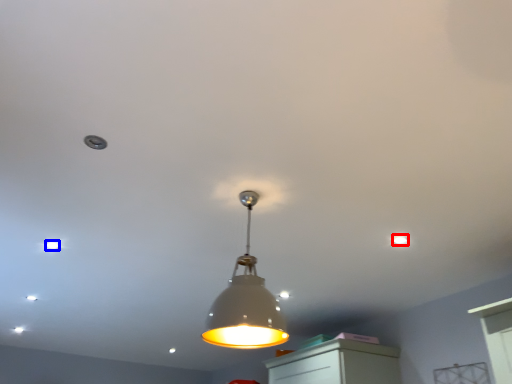
Question: Which object is closer to the camera taking this photo, dot (highlighted by a red box) or dot (highlighted by a blue box)?

Choices:
 (A) dot
 (B) dot

Answer: (A)